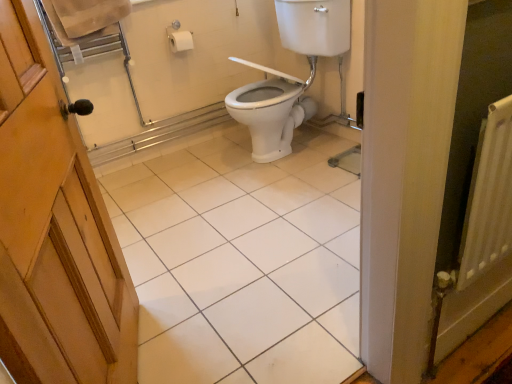
You are a GUI agent. You are given a task and a screenshot of the screen. Output one action in this format:
    pyautogui.click(x=<x>, y=<y>)
    Task: Click on the vacant area on top of white glossy tile at center (from a real-world perspective)
    This screenshot has width=512, height=384.
    Given the screenshot: What is the action you would take?
    pyautogui.click(x=228, y=218)